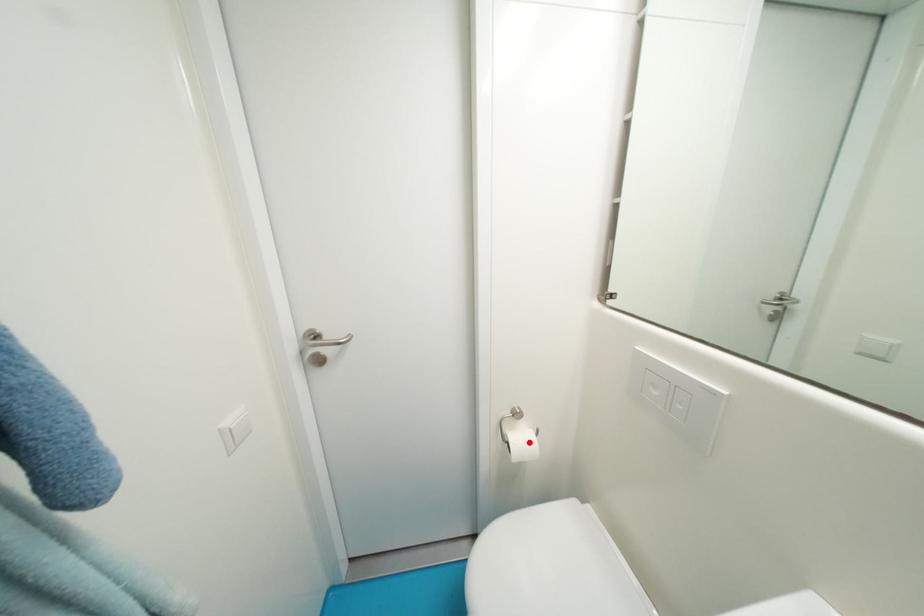
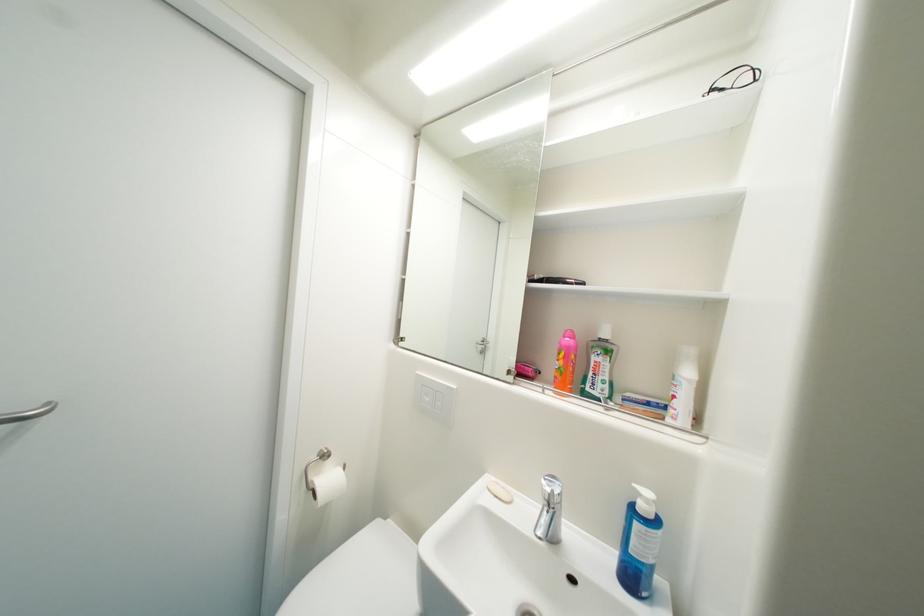
In the second image, find the point that corresponds to the highlighted location in the first image.

(337, 482)